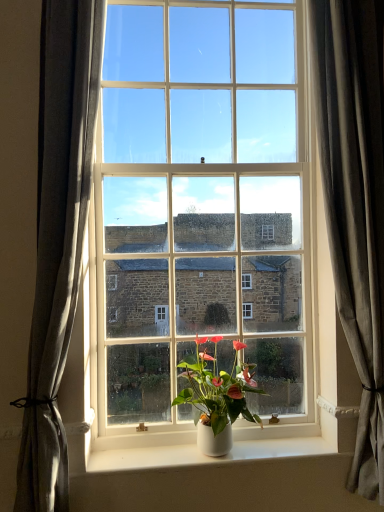
Measure the distance between gray fabric curtain at right, marked as the second curtain in a left-to-right arrangement, and camera.

The distance of gray fabric curtain at right, marked as the second curtain in a left-to-right arrangement, from camera is 5.00 feet.

What is the approximate width of white glossy pot at center?

It is 29.66 centimeters.

Where is `white matte window sill at center`? The width and height of the screenshot is (384, 512). white matte window sill at center is located at coordinates (204, 455).

Based on the photo, which object is more forward, gray fabric curtain at right, which appears as the 1th curtain when viewed from the right, or gray fabric curtain at left, the second curtain in the right-to-left sequence?

gray fabric curtain at left, the second curtain in the right-to-left sequence, is more forward.

Can you tell me how much gray fabric curtain at right, which appears as the 1th curtain when viewed from the right, and gray fabric curtain at left, the first curtain positioned from the left, differ in facing direction?

gray fabric curtain at right, which appears as the 1th curtain when viewed from the right, and gray fabric curtain at left, the first curtain positioned from the left, are facing 0.000166 degrees away from each other.

Is gray fabric curtain at right, marked as the second curtain in a left-to-right arrangement, not inside gray fabric curtain at left, the first curtain positioned from the left?

Yes, gray fabric curtain at right, marked as the second curtain in a left-to-right arrangement, is not within gray fabric curtain at left, the first curtain positioned from the left.

From the picture: Considering the sizes of objects gray fabric curtain at right, marked as the second curtain in a left-to-right arrangement, and gray fabric curtain at left, the first curtain positioned from the left, in the image provided, who is taller, gray fabric curtain at right, marked as the second curtain in a left-to-right arrangement, or gray fabric curtain at left, the first curtain positioned from the left,?

gray fabric curtain at right, marked as the second curtain in a left-to-right arrangement.

Is white matte window sill at center facing away from white glossy window at center?

That's not correct — white matte window sill at center is not looking away from white glossy window at center.

Does white matte window sill at center contain white glossy window at center?

That's incorrect, white glossy window at center is not inside white matte window sill at center.

Looking at this image, is white matte window sill at center positioned far away from white glossy window at center?

They are positioned close to each other.

In the scene shown: Which of these two, white matte window sill at center or white glossy window at center, stands taller?

white glossy window at center is taller.

Can you tell me how much white glossy window at center and white matte window sill at center differ in facing direction?

The angle between the facing direction of white glossy window at center and the facing direction of white matte window sill at center is 0.0592 degrees.

Is white glossy window at center not near white matte window sill at center?

No.

Would you say white glossy window at center is inside or outside white matte window sill at center?

white glossy window at center lies outside white matte window sill at center.

Considering the relative sizes of white glossy window at center and white matte window sill at center in the image provided, is white glossy window at center bigger than white matte window sill at center?

Yes, white glossy window at center is bigger than white matte window sill at center.

Is gray fabric curtain at right, which appears as the 1th curtain when viewed from the right, directly adjacent to white matte window sill at center?

gray fabric curtain at right, which appears as the 1th curtain when viewed from the right, and white matte window sill at center are not in contact.

Is white matte window sill at center surrounded by gray fabric curtain at right, marked as the second curtain in a left-to-right arrangement?

Definitely not — white matte window sill at center is not inside gray fabric curtain at right, marked as the second curtain in a left-to-right arrangement.

From the image's perspective, is gray fabric curtain at right, which appears as the 1th curtain when viewed from the right, located beneath white matte window sill at center?

No, from the image's perspective, gray fabric curtain at right, which appears as the 1th curtain when viewed from the right, is not beneath white matte window sill at center.

Identify the location of the 2nd curtain positioned above the white matte window sill at center (from the image's perspective). This screenshot has height=512, width=384. (355, 202).

Is the position of white glossy pot at center more distant than that of white matte window sill at center?

No.

Can you tell me how much white glossy pot at center and white matte window sill at center differ in facing direction?

0.0592 degrees separate the facing orientations of white glossy pot at center and white matte window sill at center.

Which is in front, point (190, 358) or point (226, 462)?

The point (226, 462) is closer to the camera.

Is white glossy pot at center outside of white matte window sill at center?

white glossy pot at center lies outside white matte window sill at center's area.

Is gray fabric curtain at left, the first curtain positioned from the left, taller than gray fabric curtain at right, which appears as the 1th curtain when viewed from the right?

Incorrect, the height of gray fabric curtain at left, the first curtain positioned from the left, is not larger of that of gray fabric curtain at right, which appears as the 1th curtain when viewed from the right.

Can you confirm if gray fabric curtain at left, the first curtain positioned from the left, is smaller than gray fabric curtain at right, which appears as the 1th curtain when viewed from the right?

Yes.

Where is `curtain that appears above the gray fabric curtain at left, the first curtain positioned from the left (from the image's perspective)`? Image resolution: width=384 pixels, height=512 pixels. curtain that appears above the gray fabric curtain at left, the first curtain positioned from the left (from the image's perspective) is located at coordinates (355, 202).

Is gray fabric curtain at left, the first curtain positioned from the left, with gray fabric curtain at right, marked as the second curtain in a left-to-right arrangement?

They are not placed beside each other.

Is white matte window sill at center far from gray fabric curtain at left, the second curtain in the right-to-left sequence?

white matte window sill at center is near gray fabric curtain at left, the second curtain in the right-to-left sequence, not far away.

The width and height of the screenshot is (384, 512). I want to click on window sill that appears on the right of gray fabric curtain at left, the second curtain in the right-to-left sequence, so click(x=204, y=455).

Based on the photo, from the image's perspective, is white matte window sill at center on gray fabric curtain at left, the first curtain positioned from the left?

No.

The height and width of the screenshot is (512, 384). What are the coordinates of `curtain lying behind the gray fabric curtain at left, the second curtain in the right-to-left sequence` in the screenshot? It's located at (355, 202).

This screenshot has height=512, width=384. In order to click on window lying on the left of white matte window sill at center in this screenshot , I will do `click(199, 215)`.

From the image, which object appears to be nearer to gray fabric curtain at left, the second curtain in the right-to-left sequence, gray fabric curtain at right, marked as the second curtain in a left-to-right arrangement, or white matte window sill at center?

Based on the image, white matte window sill at center appears to be nearer to gray fabric curtain at left, the second curtain in the right-to-left sequence.

Considering their positions, is white glossy pot at center positioned further to white matte window sill at center than gray fabric curtain at left, the second curtain in the right-to-left sequence?

gray fabric curtain at left, the second curtain in the right-to-left sequence, is further to white matte window sill at center.

Which object lies nearer to the anchor point white glossy window at center, gray fabric curtain at left, the first curtain positioned from the left, or white glossy pot at center?

white glossy pot at center is positioned closer to the anchor white glossy window at center.

Which object lies further to the anchor point gray fabric curtain at right, marked as the second curtain in a left-to-right arrangement, white glossy pot at center or white glossy window at center?

Among the two, white glossy pot at center is located further to gray fabric curtain at right, marked as the second curtain in a left-to-right arrangement.

Considering their positions, is gray fabric curtain at left, the second curtain in the right-to-left sequence, positioned further to white matte window sill at center than gray fabric curtain at right, which appears as the 1th curtain when viewed from the right?

Based on the image, gray fabric curtain at right, which appears as the 1th curtain when viewed from the right, appears to be further to white matte window sill at center.

When comparing their distances from gray fabric curtain at left, the first curtain positioned from the left, does gray fabric curtain at right, marked as the second curtain in a left-to-right arrangement, or white glossy pot at center seem further?

The object further to gray fabric curtain at left, the first curtain positioned from the left, is gray fabric curtain at right, marked as the second curtain in a left-to-right arrangement.

Based on their spatial positions, is white matte window sill at center or gray fabric curtain at left, the second curtain in the right-to-left sequence, closer to white glossy pot at center?

The object closer to white glossy pot at center is white matte window sill at center.

Based on their spatial positions, is white matte window sill at center or gray fabric curtain at right, which appears as the 1th curtain when viewed from the right, further from white glossy window at center?

white matte window sill at center is further to white glossy window at center.

Locate an element on the screen. This screenshot has width=384, height=512. houseplant between gray fabric curtain at left, the second curtain in the right-to-left sequence, and gray fabric curtain at right, marked as the second curtain in a left-to-right arrangement, from left to right is located at coordinates (217, 395).

This screenshot has height=512, width=384. I want to click on window between gray fabric curtain at left, the second curtain in the right-to-left sequence, and gray fabric curtain at right, which appears as the 1th curtain when viewed from the right, so click(199, 215).

Identify the location of window sill situated between gray fabric curtain at left, the second curtain in the right-to-left sequence, and gray fabric curtain at right, which appears as the 1th curtain when viewed from the right, from left to right. Image resolution: width=384 pixels, height=512 pixels. (204, 455).

I want to click on houseplant between gray fabric curtain at left, the first curtain positioned from the left, and white matte window sill at center from top to bottom, so click(217, 395).